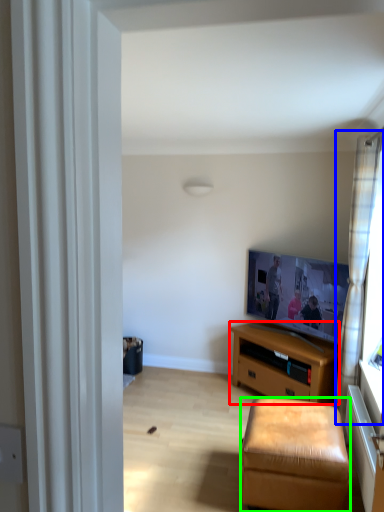
Question: Based on their relative distances, which object is nearer to desk (highlighted by a red box)? Choose from curtain (highlighted by a blue box) and stool (highlighted by a green box).

Choices:
 (A) curtain
 (B) stool

Answer: (A)